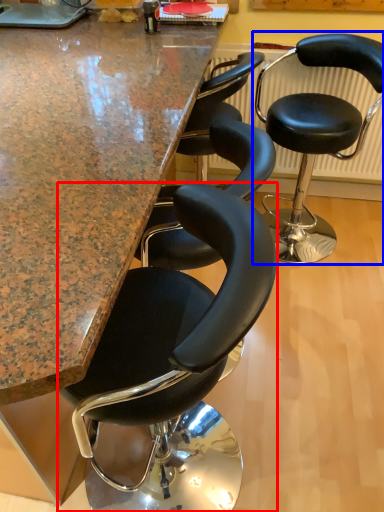
Question: Among these objects, which one is farthest to the camera, chair (highlighted by a red box) or chair (highlighted by a blue box)?

Choices:
 (A) chair
 (B) chair

Answer: (B)